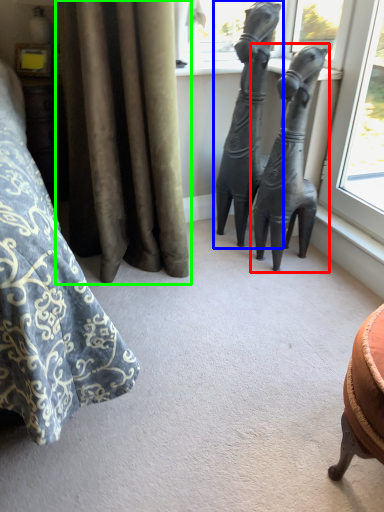
Question: Which is farther away from statue (sculpture) (highlighted by a red box)? statue (sculpture) (highlighted by a blue box) or curtain (highlighted by a green box)?

Choices:
 (A) statue (sculpture)
 (B) curtain

Answer: (B)